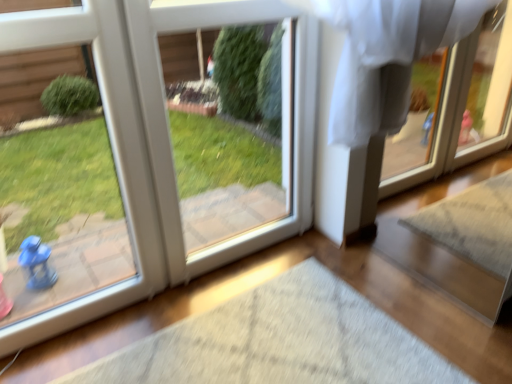
Question: From a real-world perspective, is white plastic screen door at center below white glossy door at left?

Choices:
 (A) no
 (B) yes

Answer: (B)

Question: Is white plastic screen door at center at the left side of white glossy door at left?

Choices:
 (A) yes
 (B) no

Answer: (B)

Question: Is white plastic screen door at center smaller than white glossy door at left?

Choices:
 (A) yes
 (B) no

Answer: (B)

Question: Can you confirm if white plastic screen door at center is wider than white glossy door at left?

Choices:
 (A) yes
 (B) no

Answer: (A)

Question: Considering the relative sizes of white plastic screen door at center and white glossy door at left in the image provided, is white plastic screen door at center taller than white glossy door at left?

Choices:
 (A) yes
 (B) no

Answer: (B)

Question: Is white plastic screen door at center behind white glossy door at left?

Choices:
 (A) no
 (B) yes

Answer: (B)

Question: Considering the relative sizes of white glossy door at left and white plastic screen door at center in the image provided, is white glossy door at left shorter than white plastic screen door at center?

Choices:
 (A) no
 (B) yes

Answer: (A)

Question: Does white glossy door at left have a greater height compared to white plastic screen door at center?

Choices:
 (A) no
 (B) yes

Answer: (B)

Question: Is the position of white glossy door at left less distant than that of white plastic screen door at center?

Choices:
 (A) yes
 (B) no

Answer: (A)

Question: Is white glossy door at left at the left side of white plastic screen door at center?

Choices:
 (A) yes
 (B) no

Answer: (A)

Question: Is white glossy door at left wider than white plastic screen door at center?

Choices:
 (A) no
 (B) yes

Answer: (A)

Question: Is white glossy door at left outside white plastic screen door at center?

Choices:
 (A) yes
 (B) no

Answer: (A)

Question: Considering the positions of white plastic screen door at center and white glossy door at left in the image, is white plastic screen door at center taller or shorter than white glossy door at left?

Choices:
 (A) tall
 (B) short

Answer: (B)